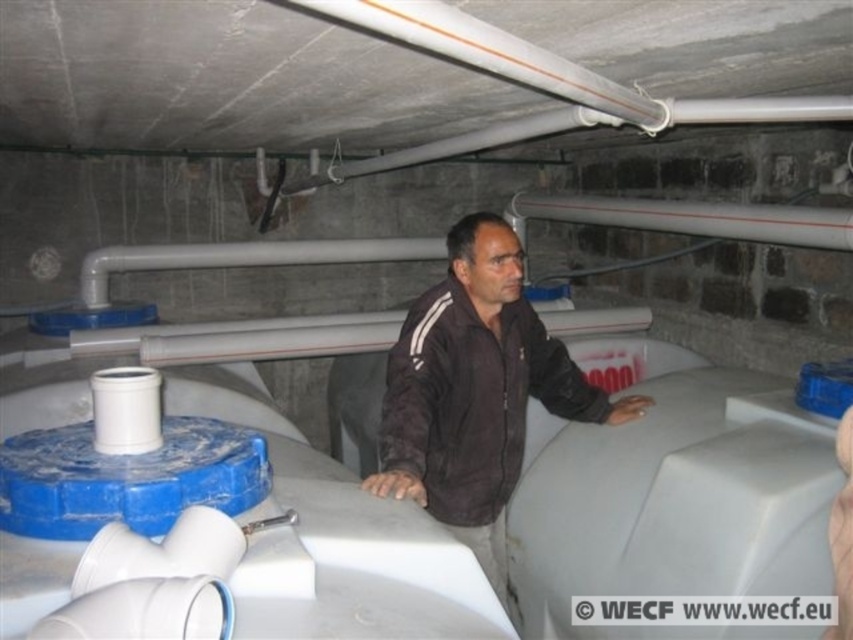
Question: Can you confirm if dark brown fabric jacket at center is positioned above white glossy pipe at upper center?

Choices:
 (A) yes
 (B) no

Answer: (B)

Question: Observing the image, what is the correct spatial positioning of dark brown fabric jacket at center in reference to white glossy pipe at upper center?

Choices:
 (A) left
 (B) right

Answer: (A)

Question: Does dark brown fabric jacket at center lie in front of white glossy pipe at upper center?

Choices:
 (A) no
 (B) yes

Answer: (B)

Question: Which point is closer to the camera?

Choices:
 (A) [x=520, y=205]
 (B) [x=492, y=385]

Answer: (B)

Question: Among these objects, which one is farthest from the camera?

Choices:
 (A) white glossy pipe at upper center
 (B) dark brown fabric jacket at center

Answer: (A)

Question: Which point is closer to the camera taking this photo?

Choices:
 (A) (802, 243)
 (B) (495, 394)

Answer: (B)